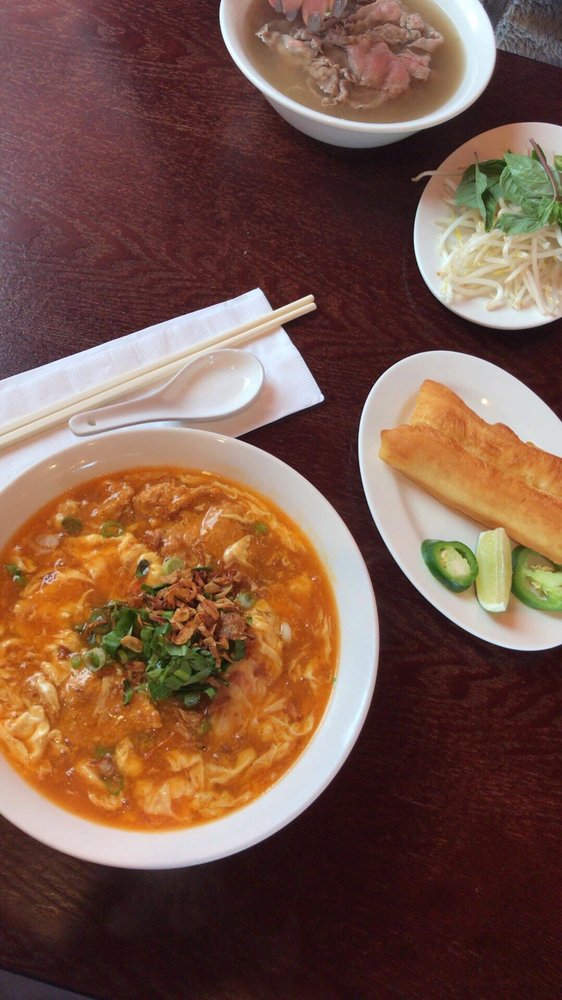
At what (x,y) coordinates should I click in order to perform the action: click on floor. Please return your answer as a coordinate pair (x, y). Looking at the image, I should click on (534, 50).